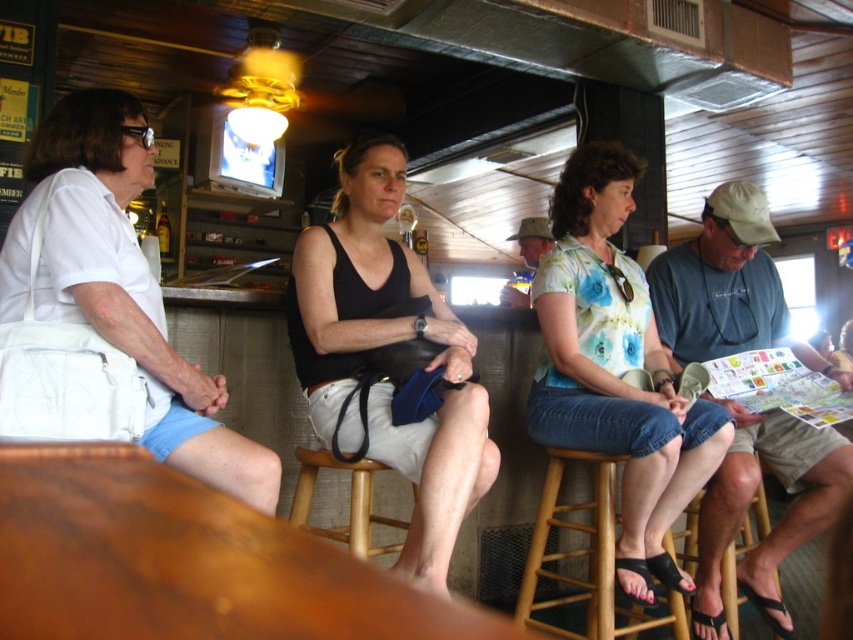
Based on the photo, can you confirm if wooden bar stool at lower center is smaller than wooden bar stool at lower right?

Yes.

Can you confirm if wooden bar stool at lower center is thinner than wooden bar stool at lower right?

Yes.

Between point (303, 472) and point (722, 556), which one is positioned in front?

Point (303, 472)

You are a GUI agent. You are given a task and a screenshot of the screen. Output one action in this format:
    pyautogui.click(x=<x>, y=<y>)
    Task: Click on the wooden bar stool at lower center
    
    Given the screenshot: What is the action you would take?
    pyautogui.click(x=349, y=500)

Does blue denim shorts at right have a smaller size compared to wooden bar stool at lower center?

Actually, blue denim shorts at right might be larger than wooden bar stool at lower center.

Between point (709, 196) and point (315, 452), which one is positioned in front?

Point (315, 452) is in front.

Locate an element on the screen. The image size is (853, 640). blue denim shorts at right is located at coordinates (779, 518).

Measure the distance between floral printed blouse at center and camera.

6.72 feet

Does floral printed blouse at center appear on the left side of camouflage hat at center?

Correct, you'll find floral printed blouse at center to the left of camouflage hat at center.

What do you see at coordinates (616, 368) in the screenshot?
I see `floral printed blouse at center` at bounding box center [616, 368].

Identify the location of floral printed blouse at center. (616, 368).